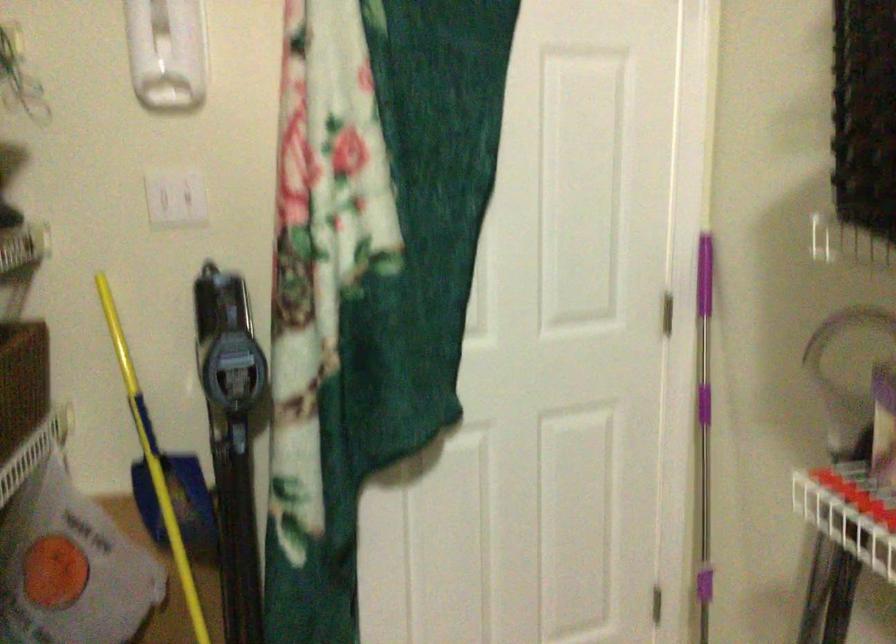
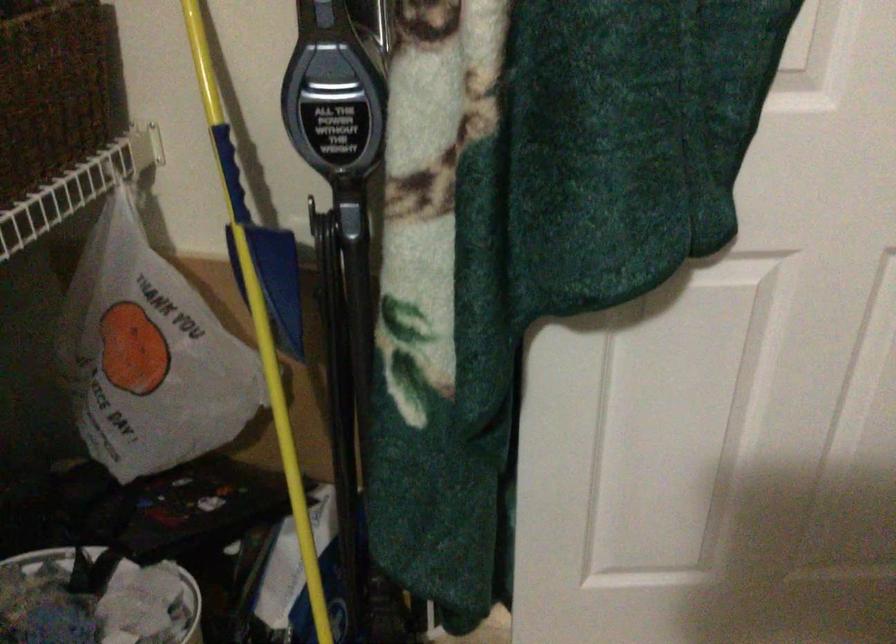
In the second image, find the point that corresponds to (72,570) in the first image.

(149, 355)